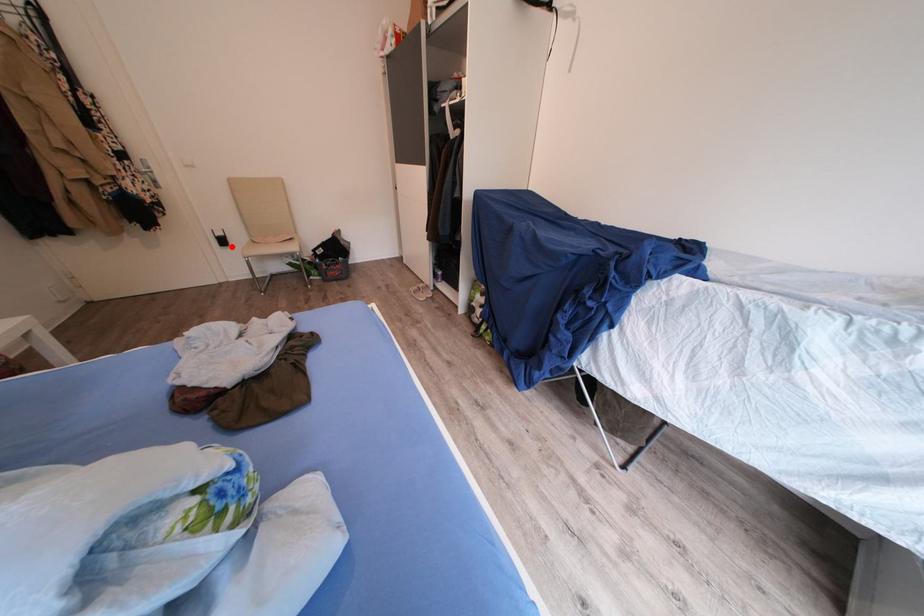
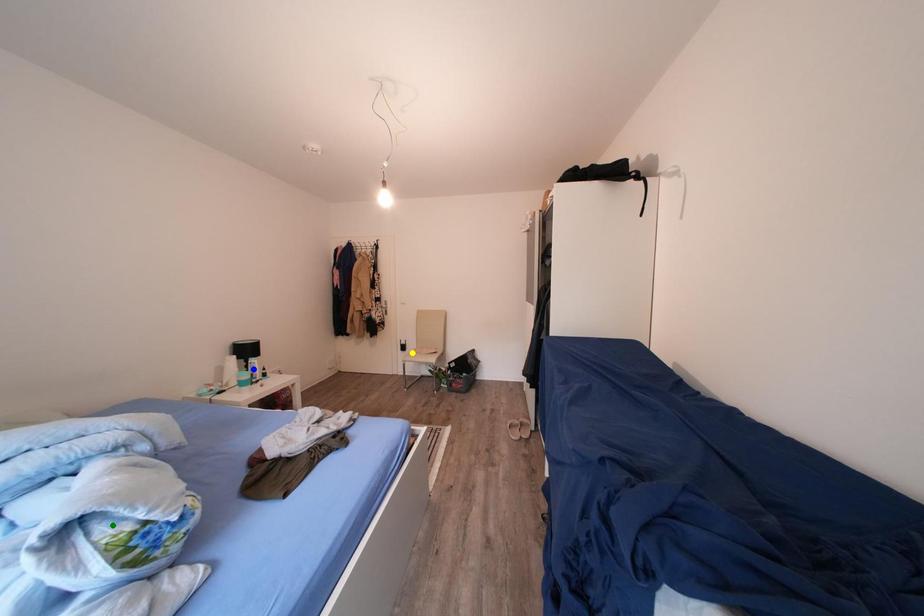
Question: I am providing you with two images of the same scene from different viewpoints. A red point is marked on the first image. You are given multiple points on the second image. Which mark in image 2 goes with the point in image 1?

Choices:
 (A) yellow point
 (B) blue point
 (C) green point

Answer: (A)